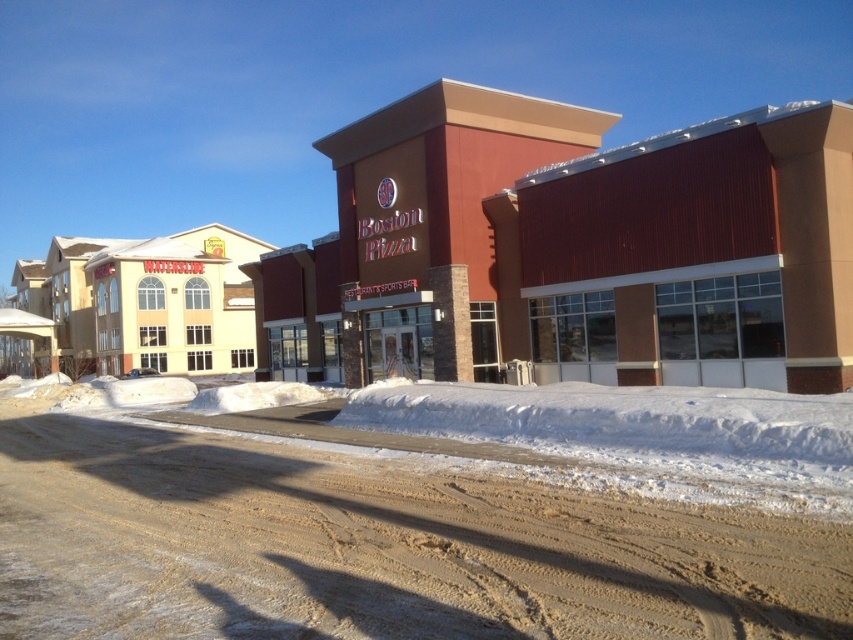
Is point (341, 260) farther from viewer compared to point (183, 531)?

Yes, point (341, 260) is behind point (183, 531).

Does point (456, 262) lie behind point (15, 490)?

That is True.

Locate an element on the screen. The width and height of the screenshot is (853, 640). matte brick building at center is located at coordinates (508, 257).